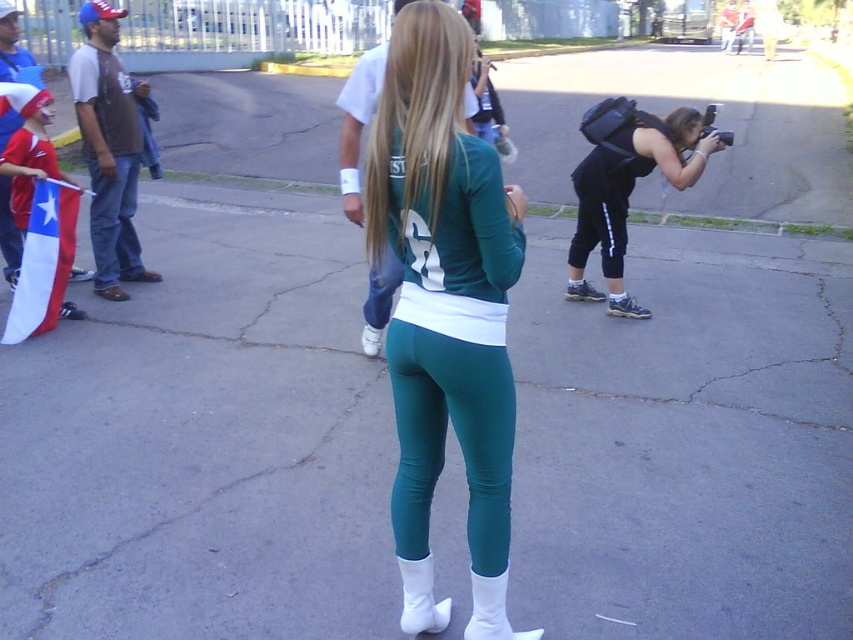
Looking at this image, is green smooth leggings at center thinner than tri-colored fabric flag at left?

Correct, green smooth leggings at center's width is less than tri-colored fabric flag at left's.

Is green smooth leggings at center taller than tri-colored fabric flag at left?

No.

The image size is (853, 640). Describe the element at coordinates (456, 435) in the screenshot. I see `green smooth leggings at center` at that location.

Where is `green smooth leggings at center`? The image size is (853, 640). green smooth leggings at center is located at coordinates (456, 435).

Which is more to the right, black matte camera at center or white matte boot at lower center?

Positioned to the right is black matte camera at center.

Is black matte camera at center positioned at the back of white matte boot at lower center?

Yes, it is behind white matte boot at lower center.

Find the location of `black matte camera at center`. black matte camera at center is located at coordinates (625, 186).

Is black matte camera at center thinner than tri-colored fabric flag at left?

No.

Who is lower down, black matte camera at center or tri-colored fabric flag at left?

Positioned lower is tri-colored fabric flag at left.

Between point (633, 150) and point (25, 241), which one is positioned in front?

Positioned in front is point (25, 241).

Identify the location of black matte camera at center. (625, 186).